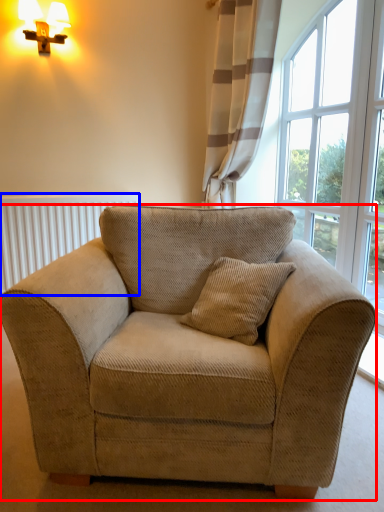
Question: Which object appears farthest to the camera in this image, studio couch (highlighted by a red box) or radiator (highlighted by a blue box)?

Choices:
 (A) studio couch
 (B) radiator

Answer: (B)